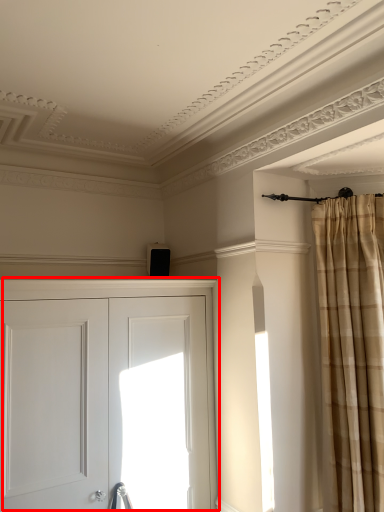
Question: From the image's perspective, considering the relative positions of door (annotated by the red box) and curtain in the image provided, where is door (annotated by the red box) located with respect to the staircase?

Choices:
 (A) above
 (B) below

Answer: (B)